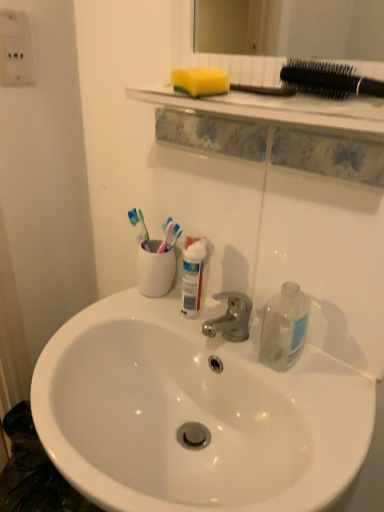
Image resolution: width=384 pixels, height=512 pixels. In order to click on free space to the left of transparent glass bottle at right in this screenshot , I will do `click(206, 333)`.